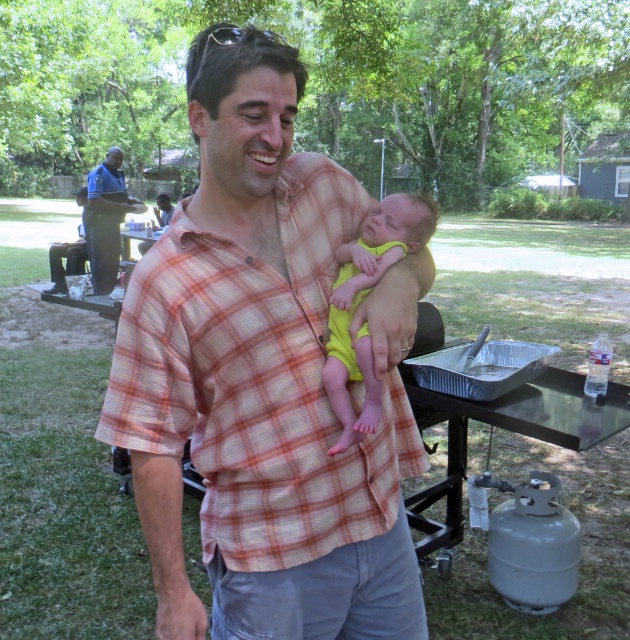
Who is taller, metallic aluminum picnic table at lower right or blue shirt at upper left?

Standing taller between the two is blue shirt at upper left.

Can you confirm if metallic aluminum picnic table at lower right is positioned to the left of blue shirt at upper left?

No, metallic aluminum picnic table at lower right is not to the left of blue shirt at upper left.

You are a GUI agent. You are given a task and a screenshot of the screen. Output one action in this format:
    pyautogui.click(x=<x>, y=<y>)
    Task: Click on the metallic aluminum picnic table at lower right
    This screenshot has width=630, height=640.
    Given the screenshot: What is the action you would take?
    pyautogui.click(x=507, y=429)

Describe the element at coordinates (263, 378) in the screenshot. I see `plaid shirt at center` at that location.

Who is positioned more to the left, plaid shirt at center or yellow fabric baby at center?

plaid shirt at center

Describe the element at coordinates (263, 378) in the screenshot. I see `plaid shirt at center` at that location.

At what (x,y) coordinates should I click in order to perform the action: click on plaid shirt at center. Please return your answer as a coordinate pair (x, y). Image resolution: width=630 pixels, height=640 pixels. Looking at the image, I should click on (263, 378).

How far apart are plaid shirt at center and blue shirt at upper left?

plaid shirt at center and blue shirt at upper left are 5.90 meters apart.

Does plaid shirt at center appear on the left side of blue shirt at upper left?

No, plaid shirt at center is not to the left of blue shirt at upper left.

Locate an element on the screen. plaid shirt at center is located at coordinates (263, 378).